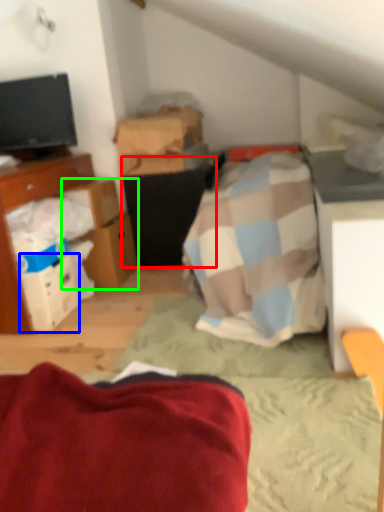
Question: Which object is the closest to the vanity (highlighted by a red box)? Choose among these: box (highlighted by a blue box) or cardboard box (highlighted by a green box).

Choices:
 (A) box
 (B) cardboard box

Answer: (B)